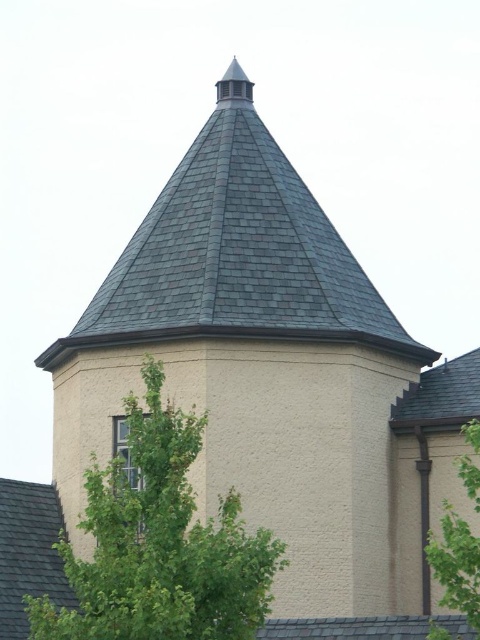
You are an architect examining the conical roof structure. You notice two sections of gray shingles at lower left and gray shingles at upper right. Which section of shingles is taller?

The gray shingles at lower left has a greater height compared to the gray shingles at upper right, so the gray shingles at lower left is taller.

You are standing in front of the building with the conical roof. You notice a point marked at coordinates (159,544). What object is located at that point?

The point at coordinates (159,544) corresponds to a green leafy tree at lower left.

You are standing in front of the building and notice the green leafy tree at lower left and the gray shingles at lower left. Which object is closer to you?

The green leafy tree at lower left is closer to you because it is in front of the gray shingles at lower left.